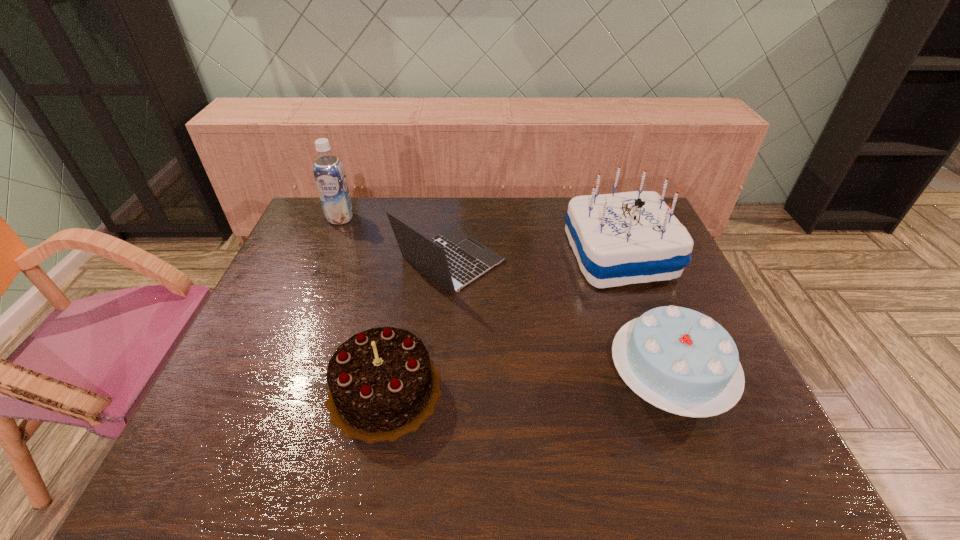
Identify the location of laptop_computer located at the far edge. Image resolution: width=960 pixels, height=540 pixels. (453, 259).

In order to click on object present at the near edge in this screenshot , I will do `click(382, 384)`.

Identify the location of object located in the left edge section of the desktop. (329, 173).

The width and height of the screenshot is (960, 540). What are the coordinates of `object at the far left corner` in the screenshot? It's located at [x=329, y=173].

Identify the location of object that is at the far right corner. (624, 238).

Locate an element on the screen. Image resolution: width=960 pixels, height=540 pixels. vacant space at the far edge of the desktop is located at coordinates (359, 222).

In the image, there is a desktop. Find the location of `free space at the near edge`. free space at the near edge is located at coordinates (632, 438).

Locate an element on the screen. This screenshot has width=960, height=540. blank space at the left edge of the desktop is located at coordinates (256, 377).

Find the location of a particular element. vacant space that is in between the leftmost object and the laptop_computer is located at coordinates (395, 240).

Where is `free space between the soya milk and the leftmost birthday cake`? The height and width of the screenshot is (540, 960). free space between the soya milk and the leftmost birthday cake is located at coordinates (363, 304).